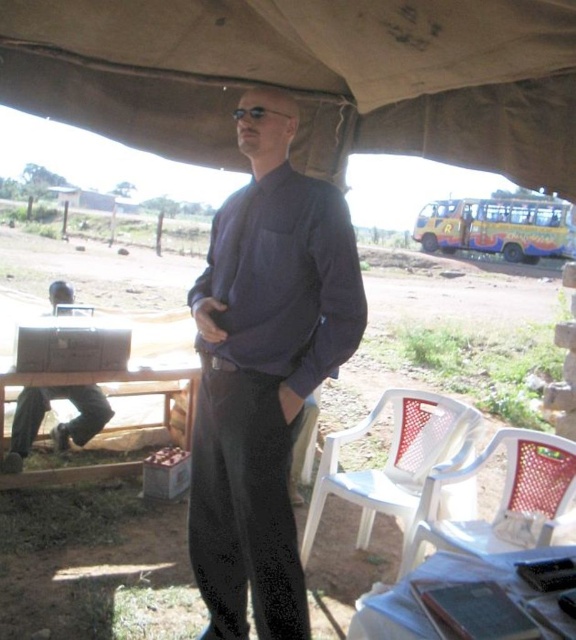
Who is positioned more to the right, dark blue shirt at center or white plastic picnic table at lower right?

From the viewer's perspective, white plastic picnic table at lower right appears more on the right side.

Between point (229, 323) and point (414, 637), which one is positioned behind?

The point (229, 323) is behind.

This screenshot has height=640, width=576. I want to click on dark blue shirt at center, so click(x=263, y=371).

Does brown canvas canopy at upper center appear on the left side of dark blue shirt at center?

No, brown canvas canopy at upper center is not to the left of dark blue shirt at center.

Is point (96, 13) closer to viewer compared to point (209, 355)?

No, (96, 13) is further to viewer.

Where is `brown canvas canopy at upper center`? The image size is (576, 640). brown canvas canopy at upper center is located at coordinates (308, 76).

This screenshot has width=576, height=640. Find the location of `white plastic chair at lower right`. white plastic chair at lower right is located at coordinates click(505, 499).

Does white plastic chair at lower right appear on the right side of metallic gray briefcase at left?

Indeed, white plastic chair at lower right is positioned on the right side of metallic gray briefcase at left.

Between point (475, 524) and point (77, 403), which one is positioned in front?

Point (475, 524) is more forward.

Find the location of `white plastic chair at lower right`. white plastic chair at lower right is located at coordinates (505, 499).